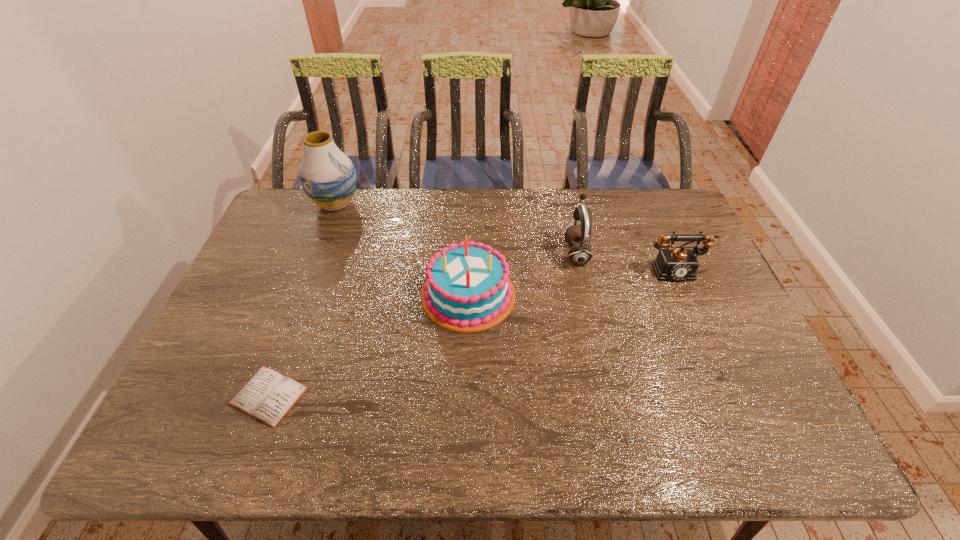
Image resolution: width=960 pixels, height=540 pixels. Find the location of `the farthest object`. the farthest object is located at coordinates (328, 177).

The image size is (960, 540). Find the location of `the tallest object`. the tallest object is located at coordinates (328, 177).

Image resolution: width=960 pixels, height=540 pixels. Find the location of `earphone`. earphone is located at coordinates (580, 253).

Where is `birthday cake`? birthday cake is located at coordinates (469, 289).

What are the coordinates of `the rightmost object` in the screenshot? It's located at (679, 264).

Find the location of a particular element. The height and width of the screenshot is (540, 960). the shortest object is located at coordinates (268, 396).

You are a GUI agent. You are given a task and a screenshot of the screen. Output one action in this format:
    pyautogui.click(x=<x>, y=<y>)
    Task: Click on the diary
    
    Given the screenshot: What is the action you would take?
    pyautogui.click(x=268, y=396)

I want to click on blank area located 0.070m on the front of the tallest object, so click(x=324, y=233).

Locate an element on the screen. vacant space located 0.110m on the ear pads of the earphone is located at coordinates (530, 253).

I want to click on vacant region located on the ear pads of the earphone, so click(x=479, y=253).